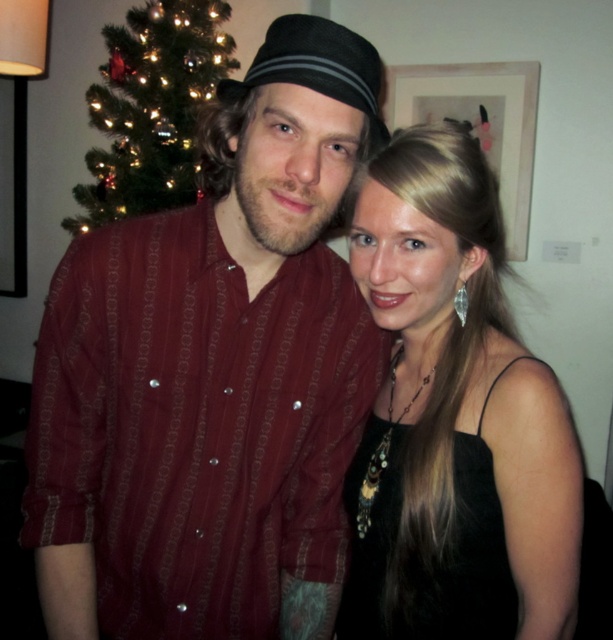
Question: Can you confirm if black satin dress at center is smaller than green glittering christmas tree at upper left?

Choices:
 (A) no
 (B) yes

Answer: (B)

Question: Estimate the real-world distances between objects in this image. Which object is closer to the black satin dress at right?

Choices:
 (A) black satin dress at center
 (B) green glittering christmas tree at upper left

Answer: (A)

Question: Which object appears closest to the camera in this image?

Choices:
 (A) black satin dress at right
 (B) green glittering christmas tree at upper left
 (C) matte red shirt at center

Answer: (C)

Question: Can you confirm if matte red shirt at center is thinner than black satin dress at right?

Choices:
 (A) yes
 (B) no

Answer: (B)

Question: Considering the relative positions of matte red shirt at center and black satin dress at right in the image provided, where is matte red shirt at center located with respect to black satin dress at right?

Choices:
 (A) below
 (B) above

Answer: (B)

Question: Which object appears closest to the camera in this image?

Choices:
 (A) black satin dress at center
 (B) green glittering christmas tree at upper left
 (C) black satin dress at right
 (D) matte red shirt at center

Answer: (D)